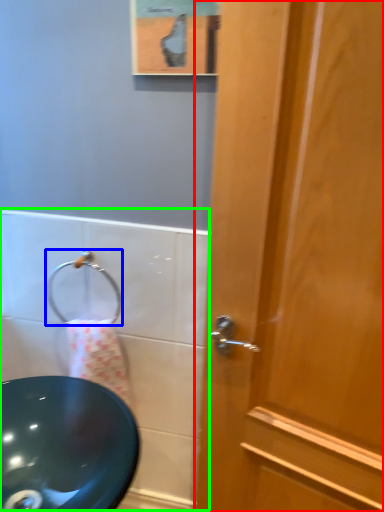
Question: Estimate the real-world distances between objects in this image. Which object is closer to door (highlighted by a red box), shower (highlighted by a blue box) or bath (highlighted by a green box)?

Choices:
 (A) shower
 (B) bath

Answer: (B)